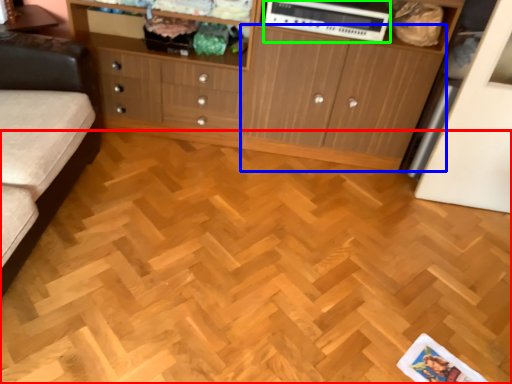
Question: Estimate the real-world distances between objects in this image. Which object is closer to plywood (highlighted by a red box), cupboard (highlighted by a blue box) or appliance (highlighted by a green box)?

Choices:
 (A) cupboard
 (B) appliance

Answer: (A)